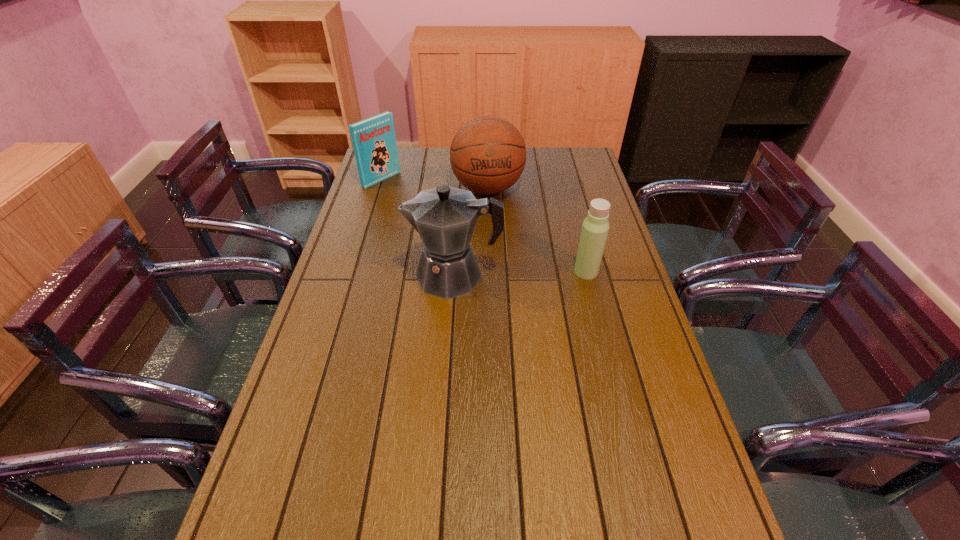
Image resolution: width=960 pixels, height=540 pixels. Identify the location of vacant space on the desktop that is between the coffeepot and the rightmost object and is positioned on the side with brand label of the basketball. (503, 274).

You are a GUI agent. You are given a task and a screenshot of the screen. Output one action in this format:
    pyautogui.click(x=<x>, y=<y>)
    Task: Click on the free space on the desktop that is between the coffeepot and the rightmost object and is positioned on the front cover of the leftmost object
    This screenshot has height=540, width=960.
    Given the screenshot: What is the action you would take?
    pyautogui.click(x=531, y=273)